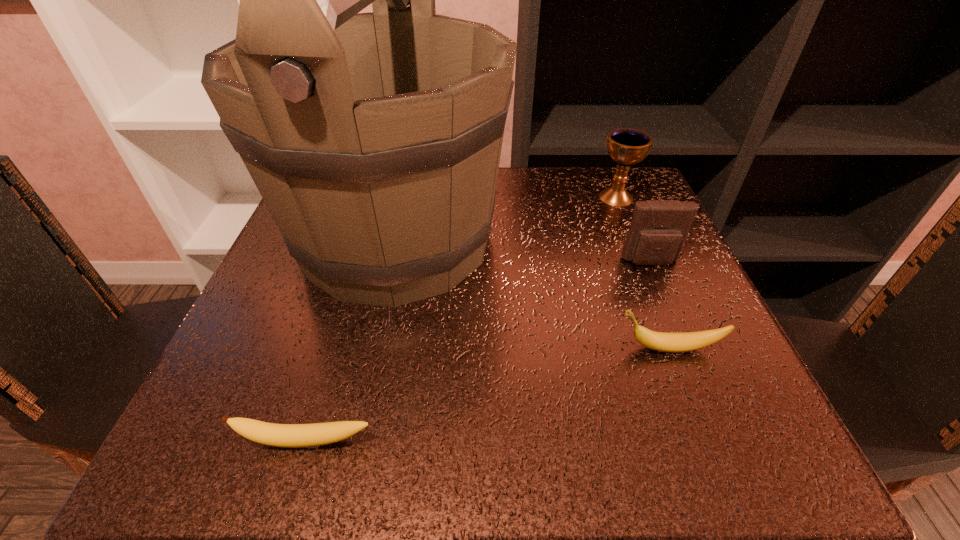
Where is `the tallest object`? This screenshot has width=960, height=540. the tallest object is located at coordinates (374, 139).

The width and height of the screenshot is (960, 540). I want to click on chalice, so click(x=626, y=146).

The image size is (960, 540). What are the coordinates of `pouch` in the screenshot? It's located at 659,228.

The width and height of the screenshot is (960, 540). What are the coordinates of `the farther banana` in the screenshot? It's located at (661, 341).

Locate an element on the screen. the right banana is located at coordinates (661, 341).

Where is `the left banana`? The image size is (960, 540). the left banana is located at coordinates [x=279, y=435].

I want to click on the shortest object, so click(x=279, y=435).

In order to click on vacant space situated 0.050m on the back of the bucket in this screenshot , I will do `click(412, 168)`.

Find the location of a particular element. Image resolution: width=960 pixels, height=540 pixels. free space located on the left of the chalice is located at coordinates (530, 197).

The height and width of the screenshot is (540, 960). I want to click on vacant space located with an open flap on the pouch, so click(x=723, y=432).